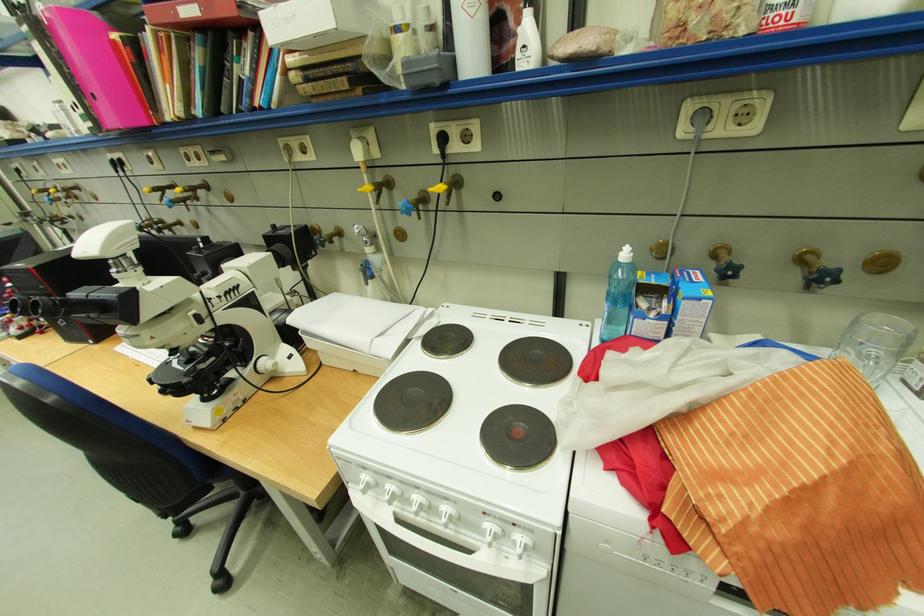
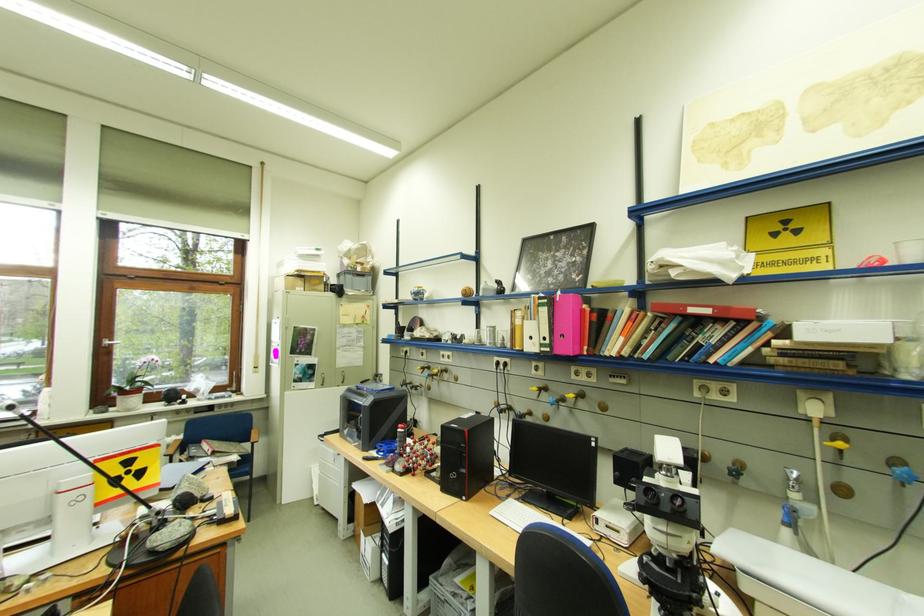
Question: I am providing you with two images of the same scene from different viewpoints. After the viewpoint changes to image2, which objects are now occluded?

Choices:
 (A) blue tap handle
 (B) glass beaker
 (C) metal cabinet handle
 (D) none of these

Answer: (D)